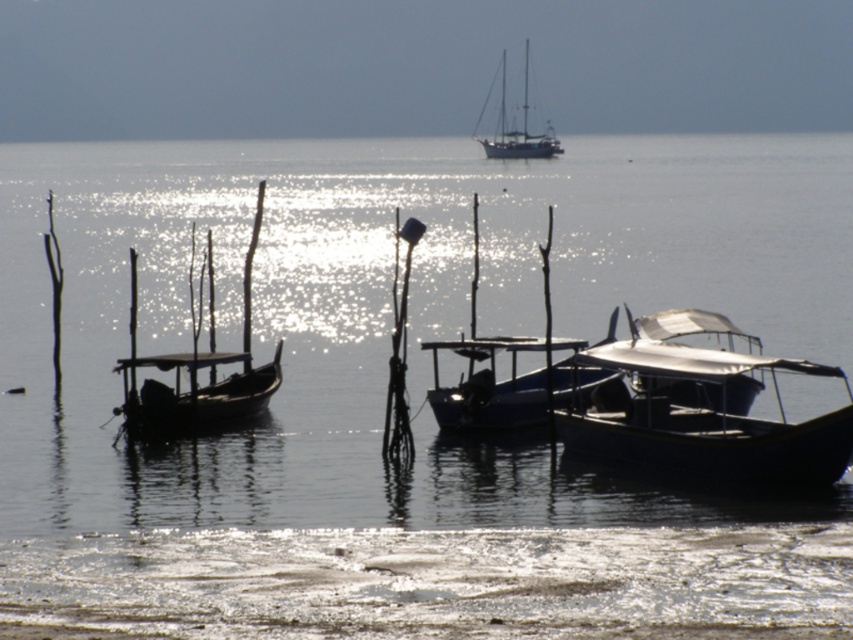
Is blue matte boat at center above dark wood boat at left?

Yes.

From the picture: Measure the distance between blue matte boat at center and dark wood boat at left.

blue matte boat at center and dark wood boat at left are 3.45 meters apart.

What do you see at coordinates (509, 385) in the screenshot? Image resolution: width=853 pixels, height=640 pixels. I see `blue matte boat at center` at bounding box center [509, 385].

This screenshot has width=853, height=640. I want to click on blue matte boat at center, so click(x=509, y=385).

Does metallic blue boat at lower right appear on the right side of blue matte boat at center?

Correct, you'll find metallic blue boat at lower right to the right of blue matte boat at center.

Does metallic blue boat at lower right appear under blue matte boat at center?

No.

This screenshot has height=640, width=853. I want to click on metallic blue boat at lower right, so pos(703,410).

The image size is (853, 640). In order to click on metallic blue boat at lower right in this screenshot , I will do `click(703, 410)`.

Find the location of a particular element. The image size is (853, 640). metallic blue boat at lower right is located at coordinates (703, 410).

Is the position of metallic blue boat at lower right more distant than that of dark wood boat at left?

No, metallic blue boat at lower right is closer to the viewer.

Which is in front, point (633, 412) or point (276, 374)?

Positioned in front is point (633, 412).

This screenshot has height=640, width=853. What are the coordinates of `metallic blue boat at lower right` in the screenshot? It's located at (703, 410).